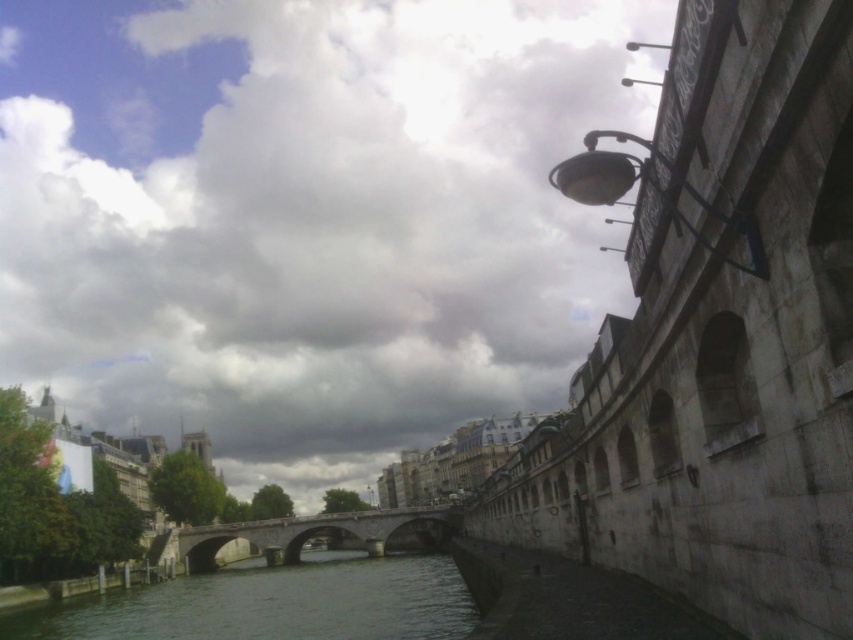
Is greenish-gray water at center bigger than stone bridge at center?

Correct, greenish-gray water at center is larger in size than stone bridge at center.

Is greenish-gray water at center thinner than stone bridge at center?

Yes.

Is point (347, 580) positioned in front of point (200, 540)?

Yes.

The width and height of the screenshot is (853, 640). What are the coordinates of `greenish-gray water at center` in the screenshot? It's located at (271, 604).

In the scene shown: Can you confirm if cloudy sky at upper center is thinner than stone bridge at center?

No, cloudy sky at upper center is not thinner than stone bridge at center.

Does cloudy sky at upper center come in front of stone bridge at center?

No.

Is point (196, 378) less distant than point (445, 538)?

No, (196, 378) is behind (445, 538).

I want to click on cloudy sky at upper center, so click(308, 216).

Consider the image. Does cloudy sky at upper center appear under greenish-gray water at center?

Incorrect, cloudy sky at upper center is not positioned below greenish-gray water at center.

Who is shorter, cloudy sky at upper center or greenish-gray water at center?

With less height is greenish-gray water at center.

Identify the location of cloudy sky at upper center. (308, 216).